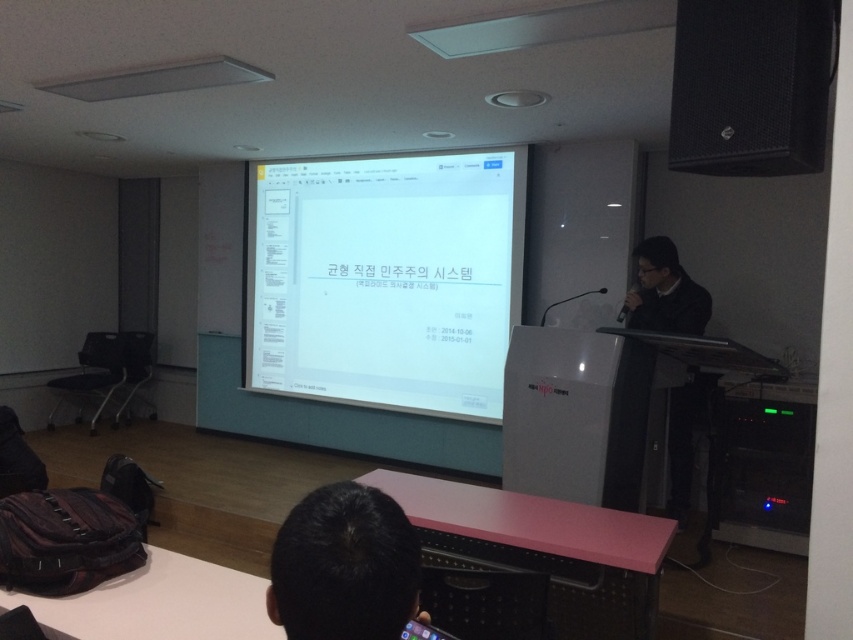
You are an attendee at the presentation and want to take a photo of the black matte speaker at upper right and the black hair at lower center. Which object should you focus on first to ensure both are in frame?

The black matte speaker at upper right might be wider than black hair at lower center, so you should focus on the black matte speaker at upper right first to ensure both are in frame.

You are an attendee at the presentation. You notice two points marked on the slide. The first point is at coordinate point(717, 83) and the second is at point(660, 248). From your perspective, which point is closer to you?

Point(717, 83) is in front of point(660, 248), so it is closer to you.